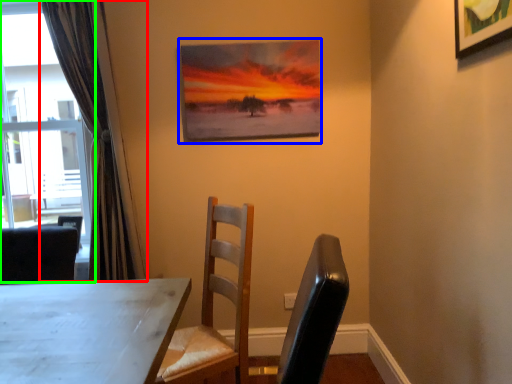
Question: Which object is the farthest from curtain (highlighted by a red box)? Choose among these: picture frame (highlighted by a blue box) or window (highlighted by a green box).

Choices:
 (A) picture frame
 (B) window

Answer: (B)